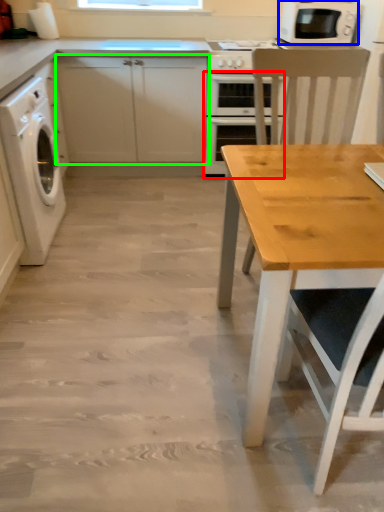
Question: Considering the real-world distances, which object is farthest from oven (highlighted by a red box)? microwave oven (highlighted by a blue box) or cabinetry (highlighted by a green box)?

Choices:
 (A) microwave oven
 (B) cabinetry

Answer: (A)